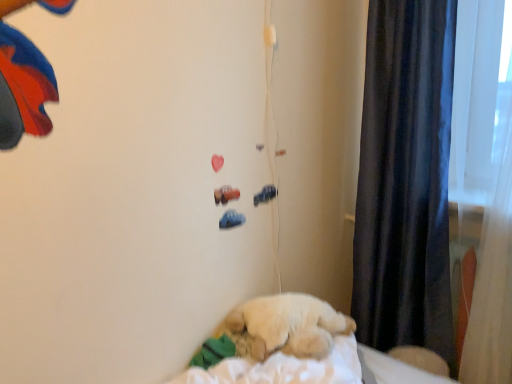
Describe the element at coordinates (405, 179) in the screenshot. The height and width of the screenshot is (384, 512). I see `dark blue velvet curtain at right` at that location.

Locate an element on the screen. fluffy beige dog at center is located at coordinates pos(284,326).

The height and width of the screenshot is (384, 512). What do you see at coordinates (285, 344) in the screenshot?
I see `white plush at center` at bounding box center [285, 344].

In order to click on dark blue velvet curtain at right in this screenshot , I will do `click(405, 179)`.

Relative to white plush at center, is white soft sheet at lower right in front or behind?

white soft sheet at lower right is positioned farther from the viewer than white plush at center.

Can we say white soft sheet at lower right lies outside white plush at center?

Yes, white soft sheet at lower right is not within white plush at center.

Looking at this image, which of these two, white soft sheet at lower right or white plush at center, stands taller?

white plush at center is taller.

Considering the sizes of objects white soft sheet at lower right and white plush at center in the image provided, who is bigger, white soft sheet at lower right or white plush at center?

With larger size is white plush at center.

Considering the points (310, 364) and (385, 377), which point is behind, point (310, 364) or point (385, 377)?

Positioned behind is point (385, 377).

Find the location of a particular element. This screenshot has width=512, height=384. sheet on the right of white plush at center is located at coordinates (398, 370).

Can you confirm if white plush at center is positioned to the right of white soft sheet at lower right?

In fact, white plush at center is to the left of white soft sheet at lower right.

Is fluffy beige dog at center completely or partially outside of white soft sheet at lower right?

Absolutely, fluffy beige dog at center is external to white soft sheet at lower right.

Considering the sizes of fluffy beige dog at center and white soft sheet at lower right in the image, is fluffy beige dog at center taller or shorter than white soft sheet at lower right?

fluffy beige dog at center is taller than white soft sheet at lower right.

Between fluffy beige dog at center and white soft sheet at lower right, which one appears on the left side from the viewer's perspective?

From the viewer's perspective, fluffy beige dog at center appears more on the left side.

Are fluffy beige dog at center and white soft sheet at lower right located far from each other?

They are positioned close to each other.

Is point (394, 372) positioned in front of point (403, 223)?

Yes, point (394, 372) is closer to viewer.

From a real-world perspective, is white soft sheet at lower right positioned over dark blue velvet curtain at right based on gravity?

Incorrect, from a real-world perspective, white soft sheet at lower right is lower than dark blue velvet curtain at right.

In terms of size, does white soft sheet at lower right appear bigger or smaller than dark blue velvet curtain at right?

Considering their sizes, white soft sheet at lower right takes up more space than dark blue velvet curtain at right.

Is white soft sheet at lower right beside dark blue velvet curtain at right?

No, white soft sheet at lower right is not making contact with dark blue velvet curtain at right.

Considering the relative positions of white soft sheet at lower right and fluffy beige dog at center in the image provided, is white soft sheet at lower right to the left or to the right of fluffy beige dog at center?

In the image, white soft sheet at lower right appears on the right side of fluffy beige dog at center.

Is white soft sheet at lower right facing towards fluffy beige dog at center?

No.

From their relative heights in the image, would you say white soft sheet at lower right is taller or shorter than fluffy beige dog at center?

Considering their sizes, white soft sheet at lower right has less height than fluffy beige dog at center.

Is point (405, 368) in front of point (327, 353)?

No.

Who is smaller, fluffy beige dog at center or dark blue velvet curtain at right?

With smaller size is dark blue velvet curtain at right.

Consider the image. Is fluffy beige dog at center to the left of dark blue velvet curtain at right from the viewer's perspective?

Yes.

How many degrees apart are the facing directions of fluffy beige dog at center and dark blue velvet curtain at right?

The facing directions of fluffy beige dog at center and dark blue velvet curtain at right are 49 degrees apart.

The image size is (512, 384). I want to click on dog below the dark blue velvet curtain at right (from a real-world perspective), so click(284, 326).

Can you tell me how much dark blue velvet curtain at right and fluffy beige dog at center differ in facing direction?

The angular difference between dark blue velvet curtain at right and fluffy beige dog at center is 49 degrees.

Who is taller, dark blue velvet curtain at right or fluffy beige dog at center?

Standing taller between the two is dark blue velvet curtain at right.

Between dark blue velvet curtain at right and fluffy beige dog at center, which one has smaller size?

dark blue velvet curtain at right is smaller.

Which object is closer to the camera, dark blue velvet curtain at right or fluffy beige dog at center?

fluffy beige dog at center is more forward.

I want to click on sheet directly beneath the white plush at center (from a real-world perspective), so click(398, 370).

Where is `bed on the left of white soft sheet at lower right`? bed on the left of white soft sheet at lower right is located at coordinates (285, 344).

When comparing their distances from dark blue velvet curtain at right, does fluffy beige dog at center or white soft sheet at lower right seem further?

fluffy beige dog at center lies further to dark blue velvet curtain at right than the other object.

From the image, which object appears to be farther from fluffy beige dog at center, white soft sheet at lower right or dark blue velvet curtain at right?

Among the two, dark blue velvet curtain at right is located further to fluffy beige dog at center.

Considering their positions, is fluffy beige dog at center positioned further to white plush at center than dark blue velvet curtain at right?

Based on the image, dark blue velvet curtain at right appears to be further to white plush at center.

Consider the image. Estimate the real-world distances between objects in this image. Which object is closer to white plush at center, fluffy beige dog at center or white soft sheet at lower right?

fluffy beige dog at center lies closer to white plush at center than the other object.

When comparing their distances from fluffy beige dog at center, does white plush at center or dark blue velvet curtain at right seem closer?

white plush at center.

In the scene shown: From the image, which object appears to be nearer to white soft sheet at lower right, dark blue velvet curtain at right or white plush at center?

white plush at center.

Which object lies further to the anchor point dark blue velvet curtain at right, white soft sheet at lower right or fluffy beige dog at center?

Based on the image, fluffy beige dog at center appears to be further to dark blue velvet curtain at right.

Based on their spatial positions, is fluffy beige dog at center or white plush at center further from dark blue velvet curtain at right?

white plush at center.

The width and height of the screenshot is (512, 384). I want to click on dog between white plush at center and dark blue velvet curtain at right from front to back, so click(x=284, y=326).

Where is `dog between dark blue velvet curtain at right and white soft sheet at lower right vertically`? This screenshot has height=384, width=512. dog between dark blue velvet curtain at right and white soft sheet at lower right vertically is located at coordinates (284, 326).

Image resolution: width=512 pixels, height=384 pixels. I want to click on dog between white plush at center and white soft sheet at lower right in the front-back direction, so click(x=284, y=326).

Where is `curtain positioned between white plush at center and white soft sheet at lower right from near to far`? curtain positioned between white plush at center and white soft sheet at lower right from near to far is located at coordinates (405, 179).